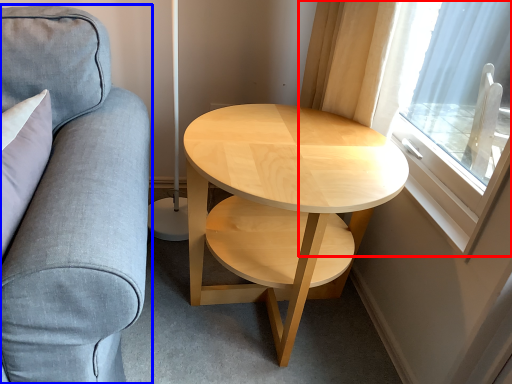
Question: Which of the following is the farthest to the observer, window (highlighted by a red box) or studio couch (highlighted by a blue box)?

Choices:
 (A) window
 (B) studio couch

Answer: (A)